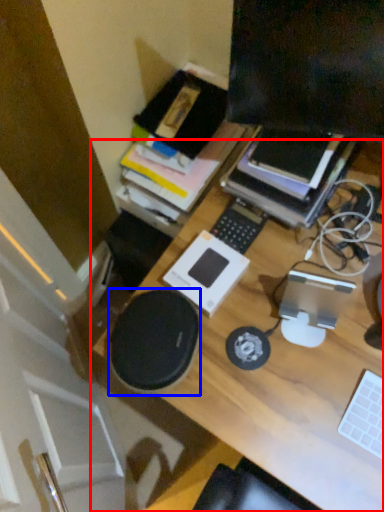
Question: Which object appears farthest to the camera in this image, desk (highlighted by a red box) or speaker (highlighted by a blue box)?

Choices:
 (A) desk
 (B) speaker

Answer: (B)